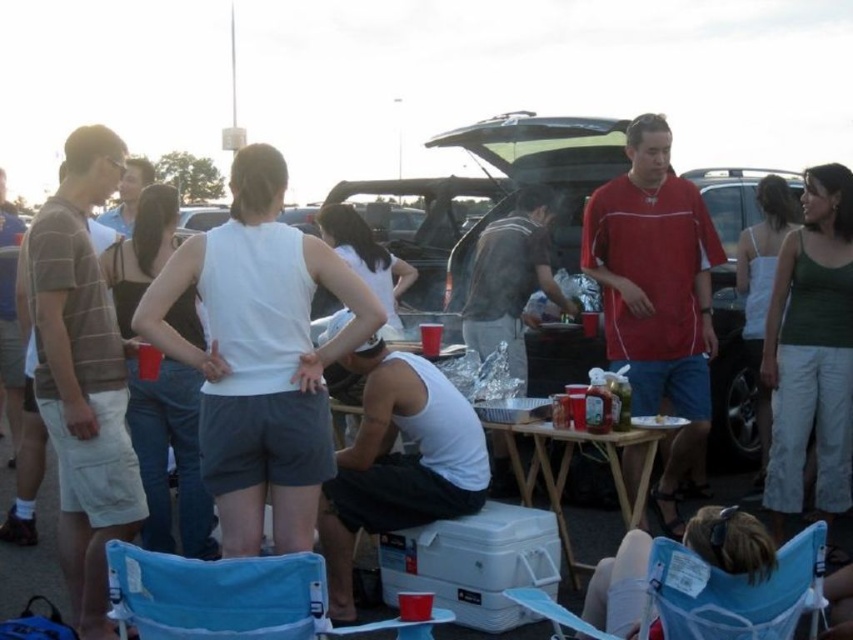
Question: Among these points, which one is farthest from the camera?

Choices:
 (A) (643, 156)
 (B) (39, 392)

Answer: (A)

Question: Which is nearer to the blue fabric chair at lower left?

Choices:
 (A) dark gray fabric shirt at center
 (B) brown striped shirt at left
 (C) red jersey at center
 (D) wooden picnic table at center

Answer: (B)

Question: Is blue fabric chair at lower right to the right of wooden picnic table at center from the viewer's perspective?

Choices:
 (A) no
 (B) yes

Answer: (B)

Question: Based on their relative distances, which object is farther from the dark gray fabric shirt at center?

Choices:
 (A) red jersey at center
 (B) blue fabric chair at lower left
 (C) wooden picnic table at center

Answer: (B)

Question: Is red jersey at center positioned before blue fabric chair at lower right?

Choices:
 (A) yes
 (B) no

Answer: (B)

Question: Is white matte tank top at center positioned behind blue fabric chair at lower right?

Choices:
 (A) no
 (B) yes

Answer: (B)